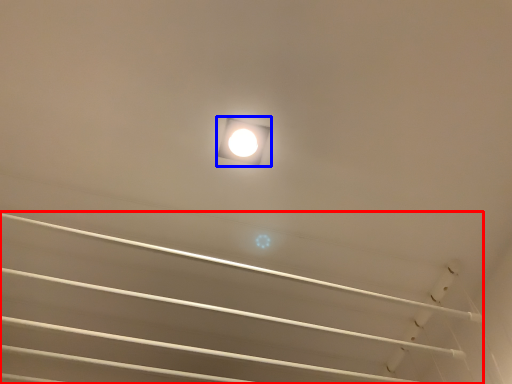
Question: Which point is further to the camera, stairwell (highlighted by a red box) or lamp (highlighted by a blue box)?

Choices:
 (A) stairwell
 (B) lamp

Answer: (B)